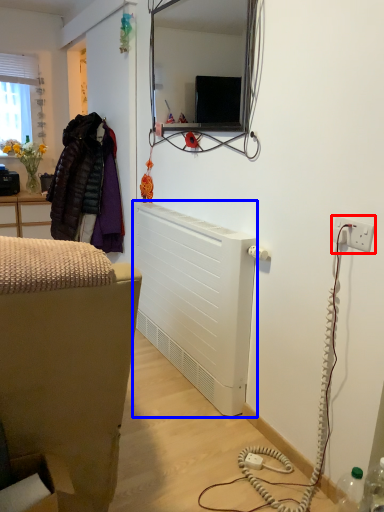
Question: Which object appears closest to the camera in this image, electric outlet (highlighted by a red box) or radiator (highlighted by a blue box)?

Choices:
 (A) electric outlet
 (B) radiator

Answer: (A)